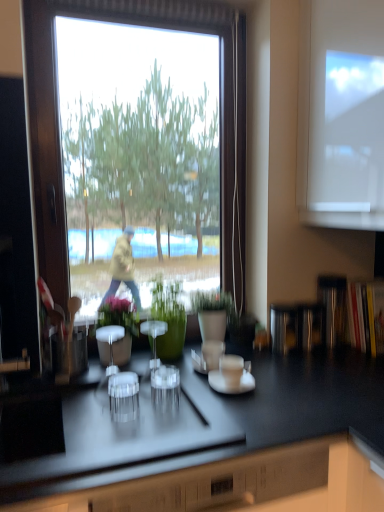
Question: From a real-world perspective, does green glossy vase at center, which is counted as the first houseplant, starting from the left, stand above green matte vase at center, placed as the 2th houseplant when sorted from right to left?

Choices:
 (A) yes
 (B) no

Answer: (B)

Question: Can you confirm if green glossy vase at center, which is counted as the first houseplant, starting from the left, is taller than green matte vase at center, placed as the 2th houseplant when sorted from right to left?

Choices:
 (A) yes
 (B) no

Answer: (B)

Question: From a real-world perspective, is green glossy vase at center, which is counted as the first houseplant, starting from the left, under green matte vase at center, which is the second houseplant in left-to-right order?

Choices:
 (A) no
 (B) yes

Answer: (B)

Question: Is green glossy vase at center, which is counted as the first houseplant, starting from the left, in front of green matte vase at center, which is the second houseplant in left-to-right order?

Choices:
 (A) no
 (B) yes

Answer: (B)

Question: Is green glossy vase at center, which is counted as the first houseplant, starting from the left, to the left of green matte vase at center, placed as the 2th houseplant when sorted from right to left, from the viewer's perspective?

Choices:
 (A) no
 (B) yes

Answer: (B)

Question: Considering the relative positions of green glossy vase at center, acting as the third houseplant starting from the right, and green matte vase at center, which is the second houseplant in left-to-right order, in the image provided, is green glossy vase at center, acting as the third houseplant starting from the right, to the right of green matte vase at center, which is the second houseplant in left-to-right order, from the viewer's perspective?

Choices:
 (A) no
 (B) yes

Answer: (A)

Question: Can you confirm if green matte vase at center, placed as the 2th houseplant when sorted from right to left, is bigger than green glossy vase at center, which is counted as the first houseplant, starting from the left?

Choices:
 (A) no
 (B) yes

Answer: (B)

Question: From a real-world perspective, does green matte vase at center, which is the second houseplant in left-to-right order, stand above green glossy vase at center, acting as the third houseplant starting from the right?

Choices:
 (A) yes
 (B) no

Answer: (A)

Question: Is green matte vase at center, placed as the 2th houseplant when sorted from right to left, positioned behind green glossy vase at center, which is counted as the first houseplant, starting from the left?

Choices:
 (A) yes
 (B) no

Answer: (A)

Question: Considering the relative sizes of green matte vase at center, placed as the 2th houseplant when sorted from right to left, and green glossy vase at center, acting as the third houseplant starting from the right, in the image provided, is green matte vase at center, placed as the 2th houseplant when sorted from right to left, shorter than green glossy vase at center, acting as the third houseplant starting from the right,?

Choices:
 (A) yes
 (B) no

Answer: (B)

Question: From the image's perspective, would you say green matte vase at center, placed as the 2th houseplant when sorted from right to left, is positioned over green glossy vase at center, acting as the third houseplant starting from the right?

Choices:
 (A) no
 (B) yes

Answer: (B)

Question: Is green matte vase at center, which is the second houseplant in left-to-right order, to the right of green glossy vase at center, acting as the third houseplant starting from the right, from the viewer's perspective?

Choices:
 (A) no
 (B) yes

Answer: (B)

Question: From the image's perspective, does green matte plant at center, arranged as the 3th houseplant when viewed from the left, appear higher than transparent plastic shot glass at center?

Choices:
 (A) yes
 (B) no

Answer: (A)